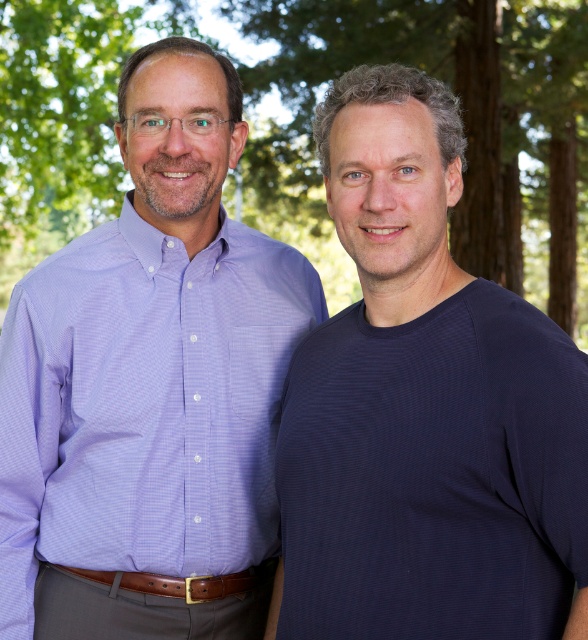
Does dark blue ribbed t-shirt at right lie behind green leafy tree at upper center?

No, dark blue ribbed t-shirt at right is closer to the viewer.

Is point (490, 332) closer to camera compared to point (455, 241)?

That is True.

Where is `dark blue ribbed t-shirt at right`? dark blue ribbed t-shirt at right is located at coordinates (425, 408).

How far apart are green leafy tree at upper center and lavender woven shirt at left?

They are 10.13 meters apart.

Does green leafy tree at upper center have a smaller size compared to lavender woven shirt at left?

Actually, green leafy tree at upper center might be larger than lavender woven shirt at left.

Which is behind, point (268, 68) or point (255, 339)?

Point (268, 68)

This screenshot has height=640, width=588. I want to click on green leafy tree at upper center, so click(463, 120).

Who is more forward, [382,440] or [98,292]?

Point [382,440] is in front.

Is dark blue ribbed t-shirt at right shorter than lavender woven shirt at left?

In fact, dark blue ribbed t-shirt at right may be taller than lavender woven shirt at left.

Between point (492, 609) and point (220, 563), which one is positioned behind?

The point (220, 563) is more distant.

You are a GUI agent. You are given a task and a screenshot of the screen. Output one action in this format:
    pyautogui.click(x=<x>, y=<y>)
    Task: Click on the dark blue ribbed t-shirt at right
    The image size is (588, 640).
    Given the screenshot: What is the action you would take?
    pyautogui.click(x=425, y=408)